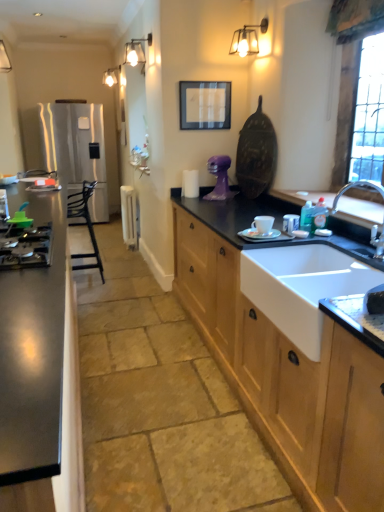
This screenshot has height=512, width=384. Find the location of `vacant space in matte glass sconce at upper center, the first light fixture viewed from the back (from a real-world perspective)`. vacant space in matte glass sconce at upper center, the first light fixture viewed from the back (from a real-world perspective) is located at coordinates (143, 280).